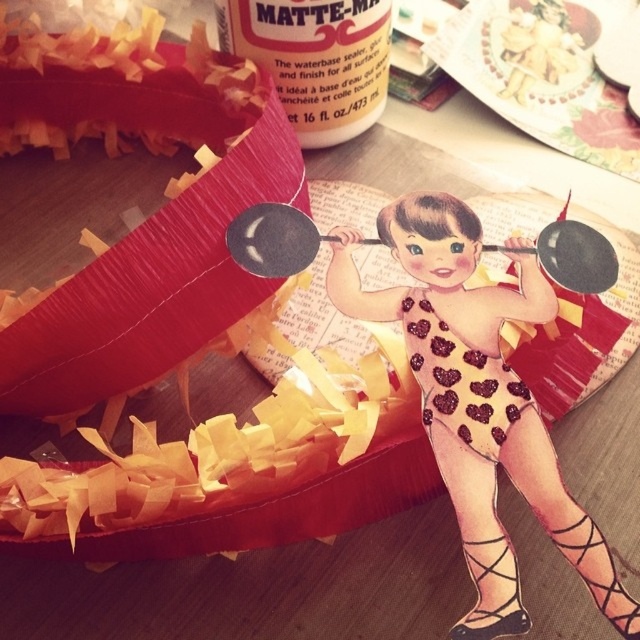
Is glittery heart-patterned swimsuit at center taller than matte ceramic plate at upper center?

Yes, glittery heart-patterned swimsuit at center is taller than matte ceramic plate at upper center.

Can you confirm if glittery heart-patterned swimsuit at center is positioned below matte ceramic plate at upper center?

Correct, glittery heart-patterned swimsuit at center is located below matte ceramic plate at upper center.

Identify the location of glittery heart-patterned swimsuit at center. The image size is (640, 640). pyautogui.click(x=477, y=401).

Is glittery heart-patterned swimsuit at center wider than matte paper piñata at upper left?

No.

Does glittery heart-patterned swimsuit at center appear over matte paper piñata at upper left?

Actually, glittery heart-patterned swimsuit at center is below matte paper piñata at upper left.

What do you see at coordinates (477, 401) in the screenshot?
I see `glittery heart-patterned swimsuit at center` at bounding box center [477, 401].

At what (x,y) coordinates should I click in order to perform the action: click on glittery heart-patterned swimsuit at center. Please return your answer as a coordinate pair (x, y). The image size is (640, 640). Looking at the image, I should click on (477, 401).

Is point (506, 32) less distant than point (301, 225)?

That is False.

Who is positioned more to the left, matte ceramic plate at upper center or black matte frying pan at center?

Positioned to the left is black matte frying pan at center.

The image size is (640, 640). Identify the location of matte ceramic plate at upper center. (544, 74).